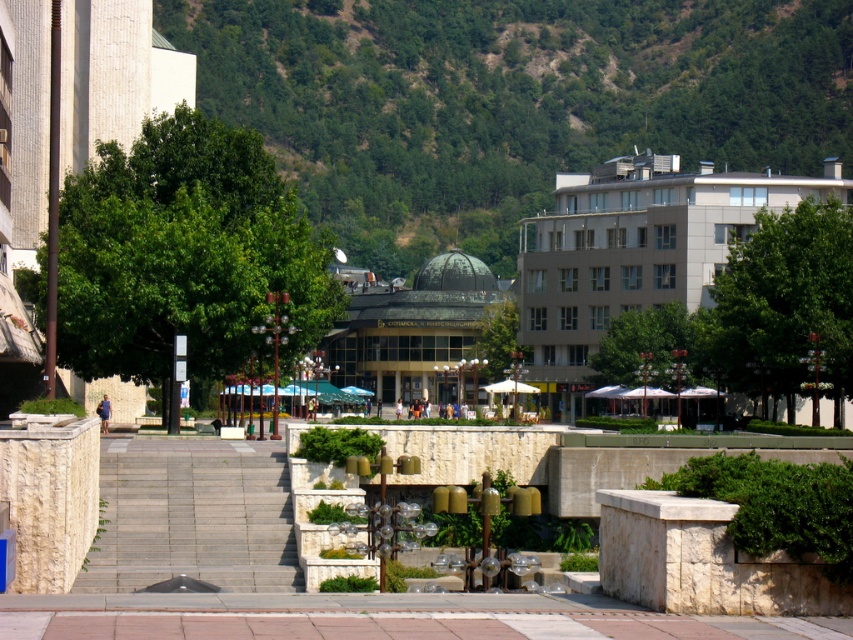
You are standing in the plaza and want to take a photo of both the beige concrete building at right and the green glass dome at center. Which object should you position to your left side to include both in the frame?

To include both the beige concrete building at right and the green glass dome at center in your photo, position the green glass dome at center to your left side since the beige concrete building at right is to the right of it.

You are standing at the point marked as point (509,100) in the image. What is the immediate terrain you are standing on?

The immediate terrain you are standing on is the green leafy hillside at upper center.